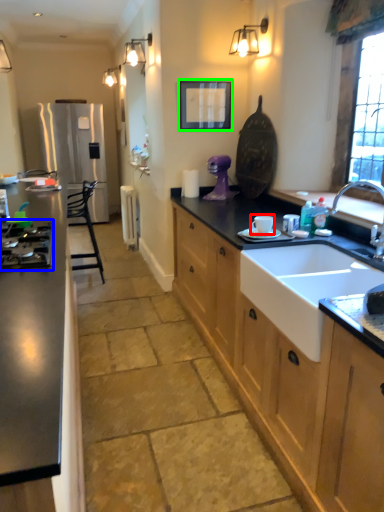
Question: Which object is positioned closest to appliance (highlighted by a red box)? Select from gas stove (highlighted by a blue box) and picture frame (highlighted by a green box).

Choices:
 (A) gas stove
 (B) picture frame

Answer: (A)